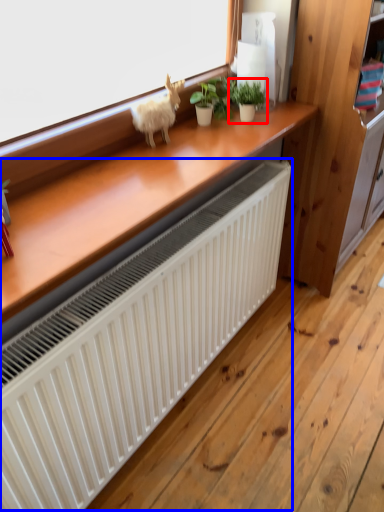
Question: Which object is further to the camera taking this photo, houseplant (highlighted by a red box) or radiator (highlighted by a blue box)?

Choices:
 (A) houseplant
 (B) radiator

Answer: (A)